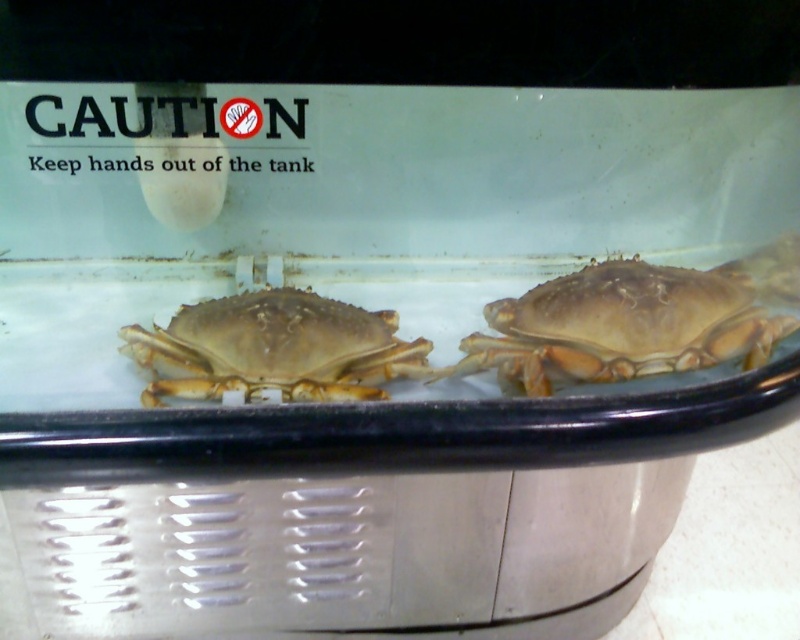
In the scene shown: Who is positioned more to the left, shiny brown crab at right or brown matte crab at center?

Positioned to the left is brown matte crab at center.

Is shiny brown crab at right closer to camera compared to brown matte crab at center?

No, shiny brown crab at right is behind brown matte crab at center.

Locate an element on the screen. shiny brown crab at right is located at coordinates (636, 321).